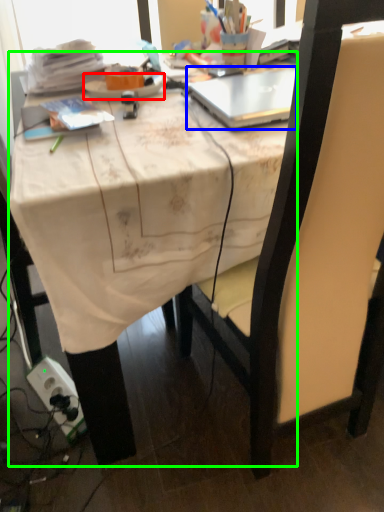
Question: Which is nearer to the plate (highlighted by a red box)? laptop (highlighted by a blue box) or desk (highlighted by a green box).

Choices:
 (A) laptop
 (B) desk

Answer: (A)